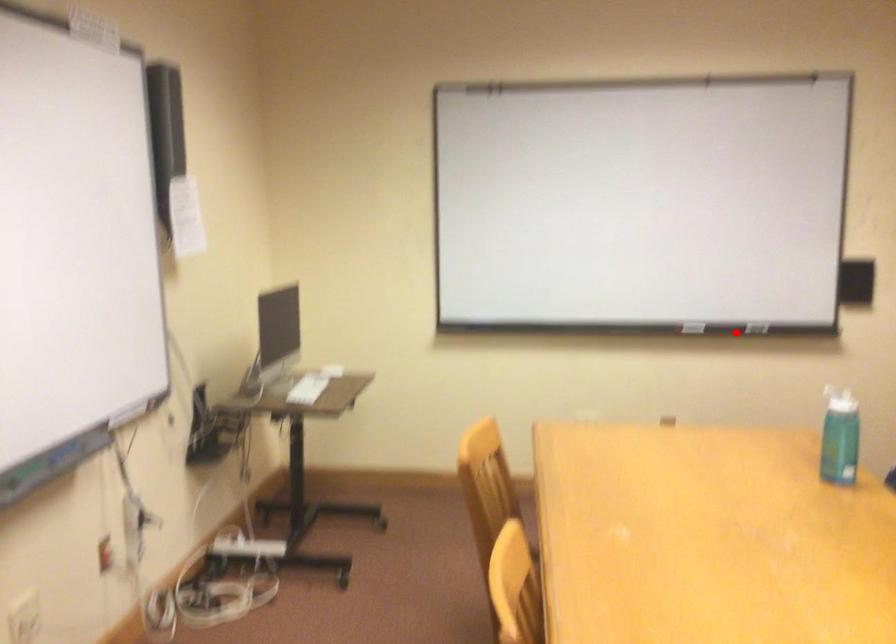
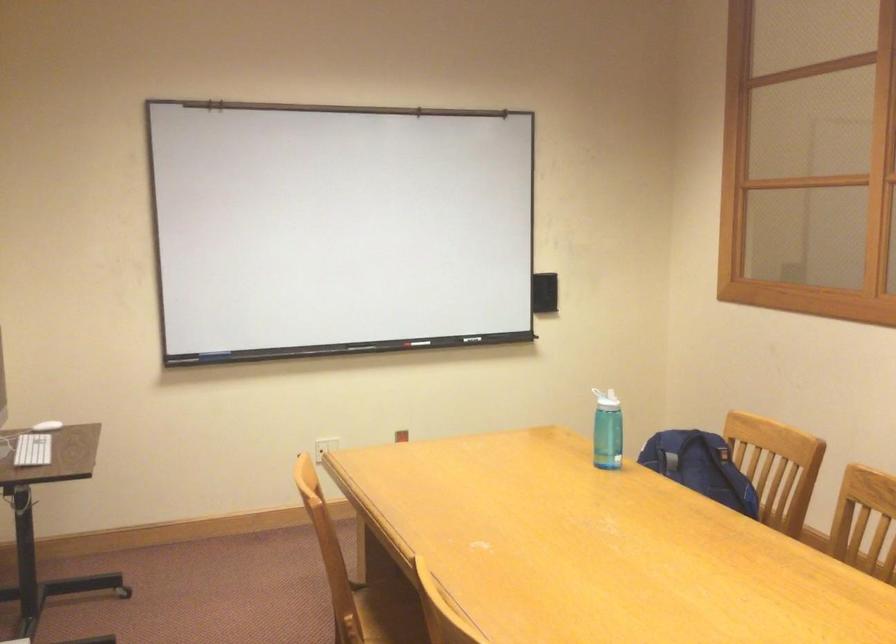
Where in the second image is the point corresponding to the highlighted location from the first image?

(420, 343)